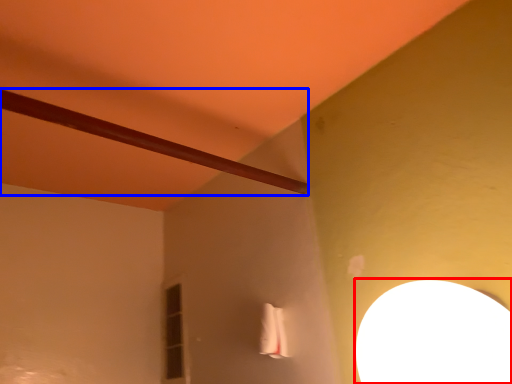
Question: Among these objects, which one is nearest to the camera, lamp (highlighted by a red box) or beam (highlighted by a blue box)?

Choices:
 (A) lamp
 (B) beam

Answer: (A)